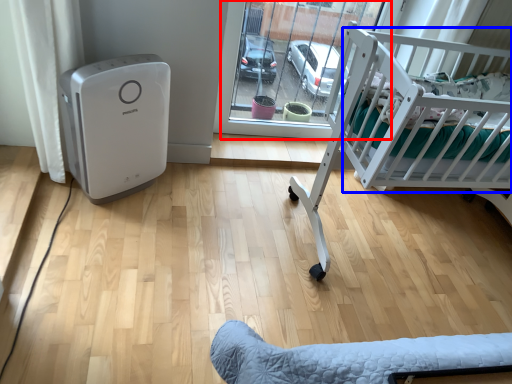
Question: Among these objects, which one is farthest to the camera, glass door (highlighted by a red box) or infant bed (highlighted by a blue box)?

Choices:
 (A) glass door
 (B) infant bed

Answer: (A)